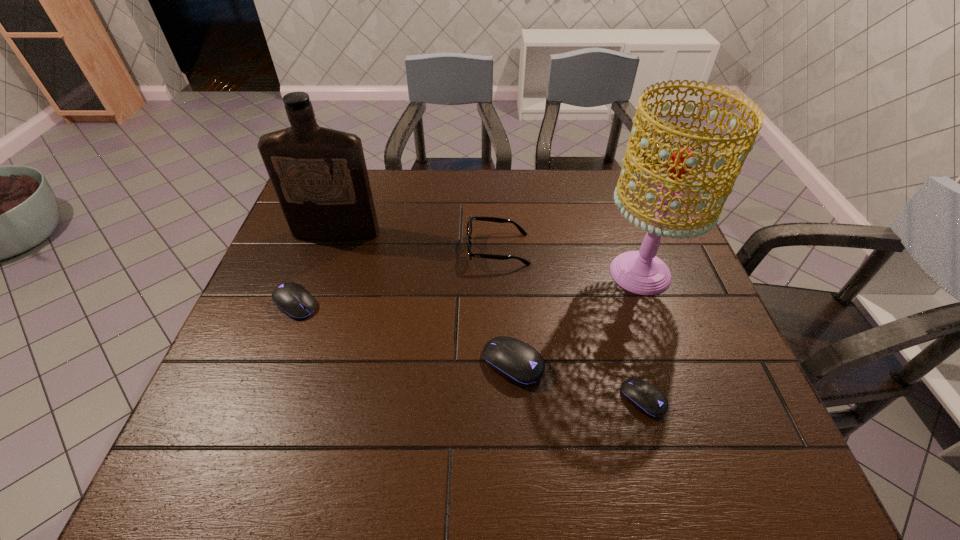
This screenshot has height=540, width=960. What are the coordinates of `vacant space located on the back of the tallest computer mouse` in the screenshot? It's located at (509, 289).

At what (x,y) coordinates should I click in order to perform the action: click on vacant region located 0.120m on the right of the shortest object. Please return your answer as a coordinate pair (x, y). Looking at the image, I should click on (721, 399).

The image size is (960, 540). In order to click on vacant space located 0.060m on the left of the lampshade in this screenshot , I will do `click(574, 273)`.

Identify the location of vacant space situated 0.070m on the lenses of the spectacles. Image resolution: width=960 pixels, height=540 pixels. (442, 249).

At what (x,y) coordinates should I click in order to perform the action: click on vacant region located 0.280m on the lenses of the spectacles. Please return your answer as a coordinate pair (x, y). The width and height of the screenshot is (960, 540). Looking at the image, I should click on (367, 249).

Where is `free location located 0.380m on the lenses of the spectacles`? This screenshot has height=540, width=960. free location located 0.380m on the lenses of the spectacles is located at coordinates (331, 249).

Locate an element on the screen. free space located 0.170m on the label side of the liquor is located at coordinates (318, 285).

The height and width of the screenshot is (540, 960). Find the location of `computer mouse that is at the left edge`. computer mouse that is at the left edge is located at coordinates (293, 299).

At what (x,y) coordinates should I click in order to perform the action: click on liquor located at the left edge. Please return your answer as a coordinate pair (x, y). The image size is (960, 540). Looking at the image, I should click on (319, 175).

The image size is (960, 540). In order to click on object that is at the right edge in this screenshot , I will do `click(641, 272)`.